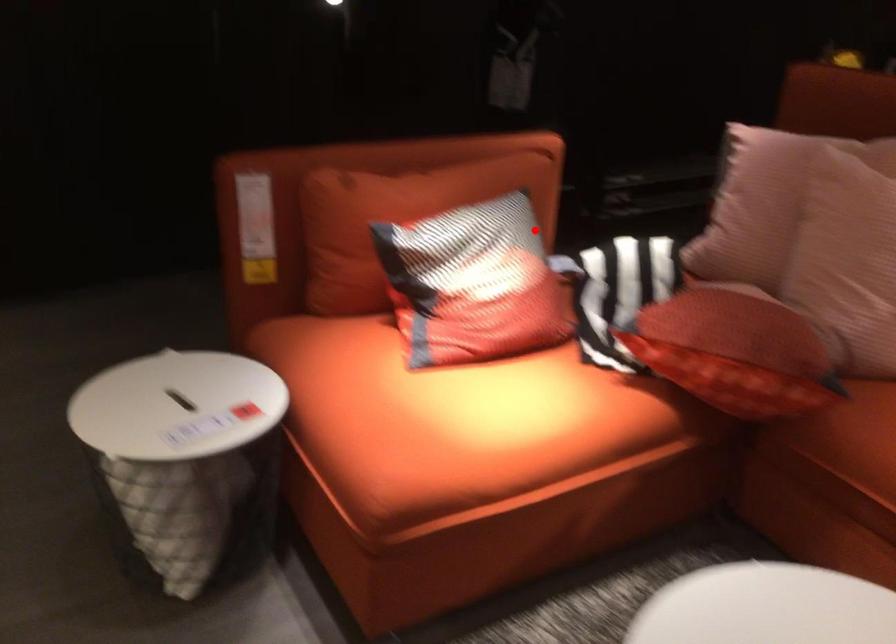
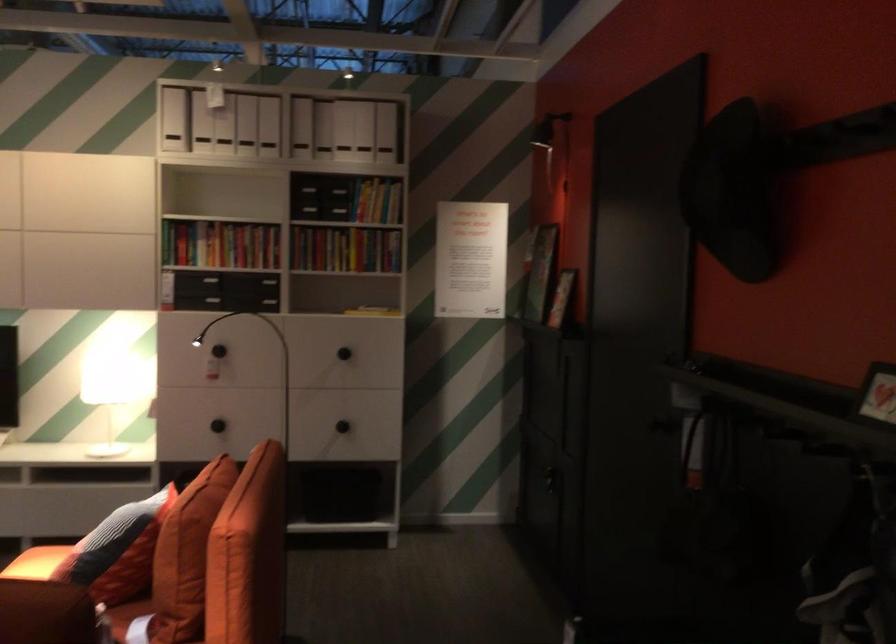
Question: I am providing you with two images of the same scene from different viewpoints. Given a red point in image1, look at the same physical point in image2. Is it:

Choices:
 (A) Closer to the viewpoint
 (B) Farther from the viewpoint

Answer: (B)